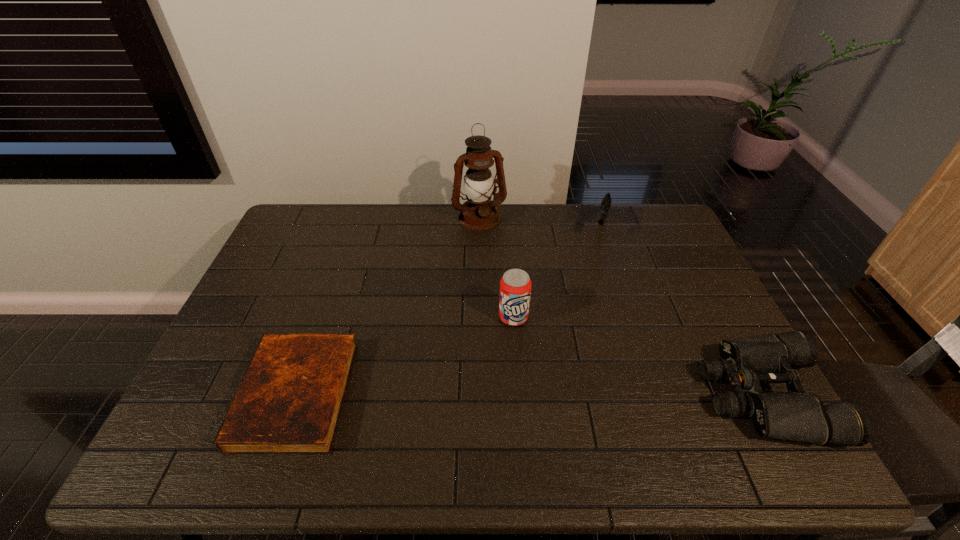
Find the location of `vacant region between the binoculars and the third farthest object`. vacant region between the binoculars and the third farthest object is located at coordinates (638, 356).

The height and width of the screenshot is (540, 960). I want to click on empty space that is in between the third farthest object and the leftmost object, so click(x=405, y=356).

You are a GUI agent. You are given a task and a screenshot of the screen. Output one action in this format:
    pyautogui.click(x=<x>, y=<y>)
    Task: Click on the free spot between the fourth shortest object and the lantern
    The image size is (960, 540).
    Given the screenshot: What is the action you would take?
    pyautogui.click(x=496, y=268)

This screenshot has height=540, width=960. I want to click on unoccupied area between the tallest object and the binoculars, so click(621, 307).

The image size is (960, 540). Identify the location of free space between the soda can and the rightmost object. (638, 356).

Locate an element on the screen. This screenshot has height=540, width=960. vacant area that lies between the third tallest object and the rightmost object is located at coordinates (682, 311).

Find the location of a particular element. the fourth closest object relative to the third farthest object is located at coordinates (796, 415).

The height and width of the screenshot is (540, 960). I want to click on the third closest object to the rightmost object, so click(480, 213).

Locate an element on the screen. free space that satisfies the following two spatial constraints: 1. on the front side of the tallest object; 2. on the left side of the second tallest object is located at coordinates coord(479,317).